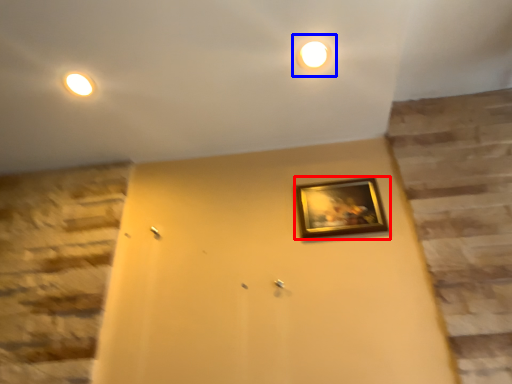
Question: Which of the following is the farthest to the observer, picture frame (highlighted by a red box) or light (highlighted by a blue box)?

Choices:
 (A) picture frame
 (B) light

Answer: (A)